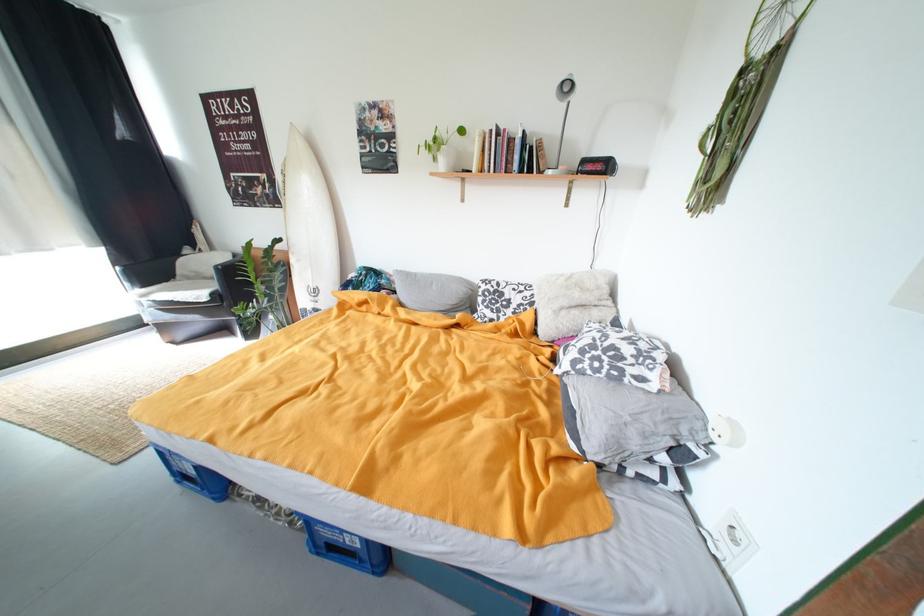
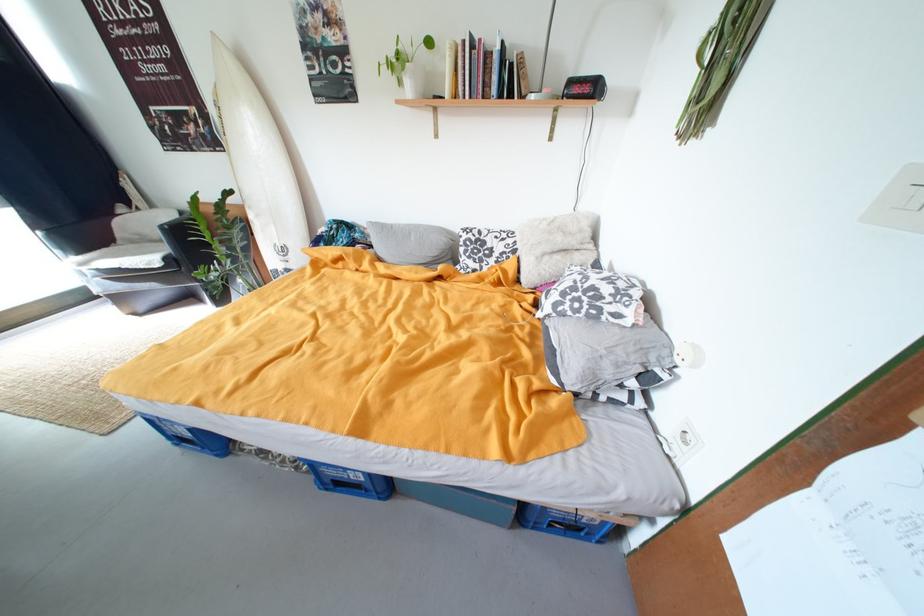
The point at (582, 363) is marked in the first image. Where is the corresponding point in the second image?

(564, 306)